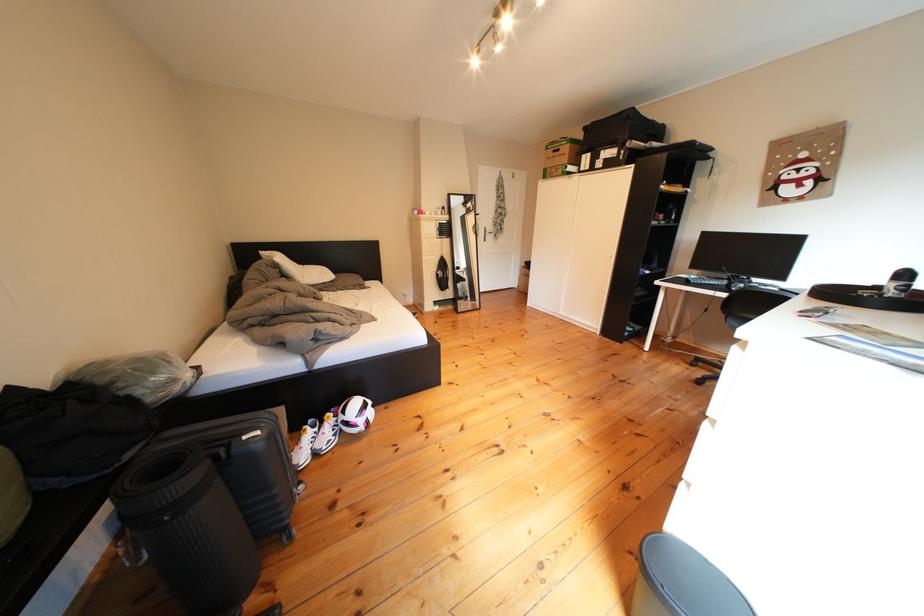
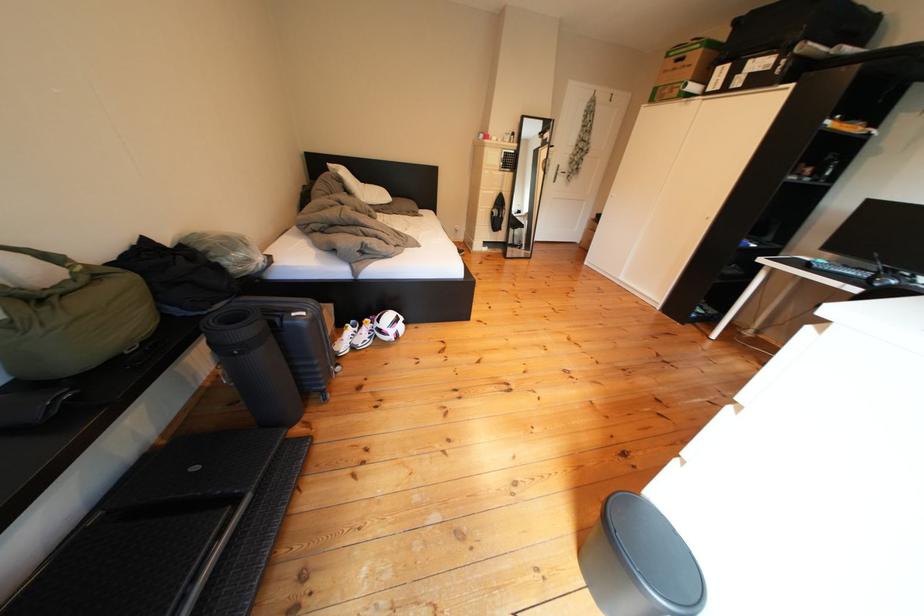
In the second image, find the point that corresponds to [123,476] in the first image.

(217, 318)